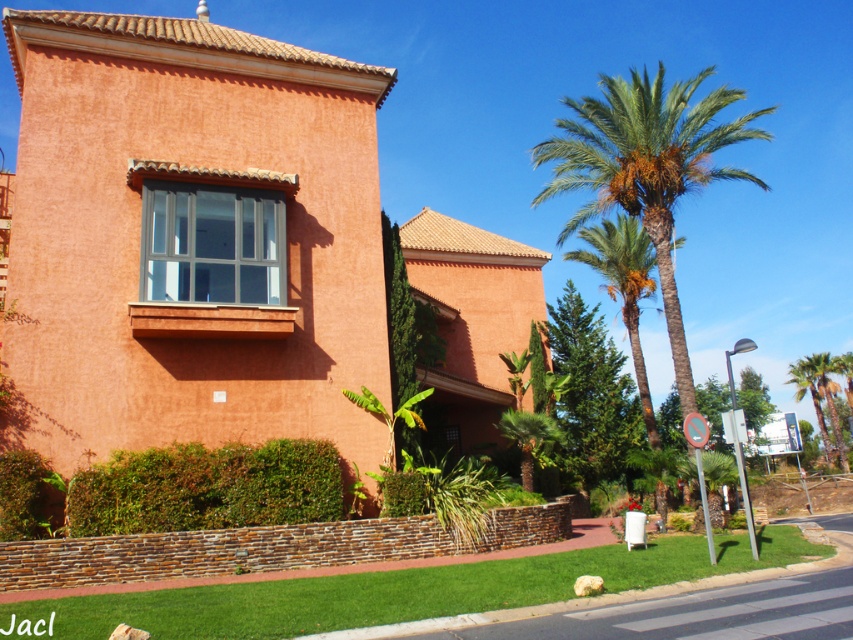
Question: Is green leafy palm at right positioned in front of green leafy palm tree at right?

Choices:
 (A) yes
 (B) no

Answer: (A)

Question: Among these objects, which one is nearest to the camera?

Choices:
 (A) green leafy palm at right
 (B) brown stone curb at lower center
 (C) green leafy palm tree at right

Answer: (B)

Question: Which point is farther to the camera?

Choices:
 (A) green leafy palm tree at right
 (B) green leafy palm at right
 (C) brown stone curb at lower center

Answer: (A)

Question: Among these points, which one is nearest to the camera?

Choices:
 (A) (653, 170)
 (B) (828, 387)
 (C) (369, 627)

Answer: (C)

Question: Where is green leafy palm at right located in relation to green leafy palm tree at right in the image?

Choices:
 (A) left
 (B) right

Answer: (A)

Question: Observing the image, what is the correct spatial positioning of green leafy palm at right in reference to green leafy palm tree at right?

Choices:
 (A) left
 (B) right

Answer: (A)